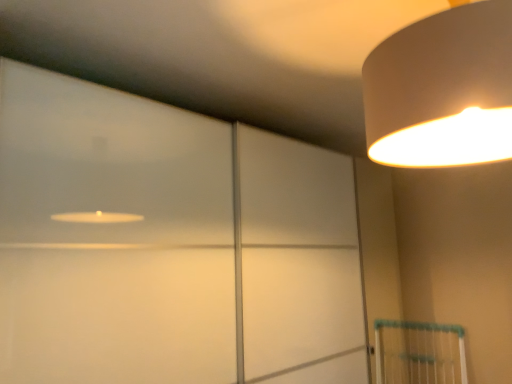
Question: Is transparent glass door at upper left directly adjacent to white matte lampshade at upper right?

Choices:
 (A) yes
 (B) no

Answer: (B)

Question: Is transparent glass door at upper left at the right side of white matte lampshade at upper right?

Choices:
 (A) yes
 (B) no

Answer: (B)

Question: Can you confirm if transparent glass door at upper left is bigger than white matte lampshade at upper right?

Choices:
 (A) no
 (B) yes

Answer: (B)

Question: Is transparent glass door at upper left at the left side of white matte lampshade at upper right?

Choices:
 (A) yes
 (B) no

Answer: (A)

Question: Is transparent glass door at upper left oriented away from white matte lampshade at upper right?

Choices:
 (A) no
 (B) yes

Answer: (A)

Question: Does transparent glass door at upper left turn towards white matte lampshade at upper right?

Choices:
 (A) yes
 (B) no

Answer: (A)

Question: Does white matte lampshade at upper right lie in front of transparent glass door at upper left?

Choices:
 (A) yes
 (B) no

Answer: (A)

Question: Would you say white matte lampshade at upper right is a long distance from transparent glass door at upper left?

Choices:
 (A) yes
 (B) no

Answer: (B)

Question: From the image's perspective, is white matte lampshade at upper right under transparent glass door at upper left?

Choices:
 (A) no
 (B) yes

Answer: (A)

Question: Considering the relative positions of white matte lampshade at upper right and transparent glass door at upper left in the image provided, is white matte lampshade at upper right to the right of transparent glass door at upper left from the viewer's perspective?

Choices:
 (A) yes
 (B) no

Answer: (A)

Question: Would you say white matte lampshade at upper right is outside transparent glass door at upper left?

Choices:
 (A) no
 (B) yes

Answer: (B)

Question: Is white matte lampshade at upper right turned away from transparent glass door at upper left?

Choices:
 (A) yes
 (B) no

Answer: (B)

Question: In terms of height, does white matte lampshade at upper right look taller or shorter compared to transparent glass door at upper left?

Choices:
 (A) short
 (B) tall

Answer: (A)